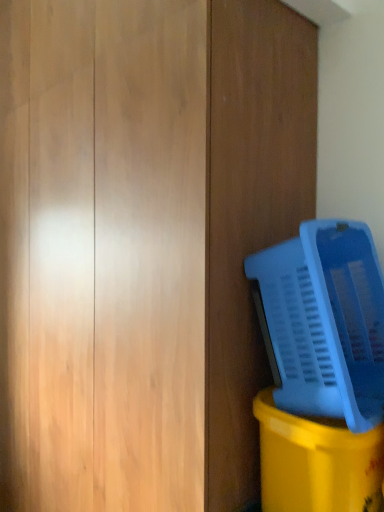
Question: From a real-world perspective, is blue plastic basket at right positioned under matte plastic basket at lower right based on gravity?

Choices:
 (A) yes
 (B) no

Answer: (B)

Question: Can you confirm if blue plastic basket at right is positioned to the right of matte plastic basket at lower right?

Choices:
 (A) yes
 (B) no

Answer: (B)

Question: From the image's perspective, is blue plastic basket at right over matte plastic basket at lower right?

Choices:
 (A) no
 (B) yes

Answer: (B)

Question: Does blue plastic basket at right have a lesser height compared to matte plastic basket at lower right?

Choices:
 (A) yes
 (B) no

Answer: (B)

Question: From the image's perspective, is blue plastic basket at right beneath matte plastic basket at lower right?

Choices:
 (A) no
 (B) yes

Answer: (A)

Question: Is blue plastic basket at right behind matte plastic basket at lower right?

Choices:
 (A) yes
 (B) no

Answer: (B)

Question: Does matte plastic basket at lower right have a lesser height compared to blue plastic basket at right?

Choices:
 (A) yes
 (B) no

Answer: (A)

Question: Are matte plastic basket at lower right and blue plastic basket at right beside each other?

Choices:
 (A) no
 (B) yes

Answer: (A)

Question: Is matte plastic basket at lower right looking in the opposite direction of blue plastic basket at right?

Choices:
 (A) yes
 (B) no

Answer: (B)

Question: From a real-world perspective, is matte plastic basket at lower right located higher than blue plastic basket at right?

Choices:
 (A) no
 (B) yes

Answer: (A)

Question: Does matte plastic basket at lower right lie behind blue plastic basket at right?

Choices:
 (A) yes
 (B) no

Answer: (A)

Question: Could you tell me if matte plastic basket at lower right is facing blue plastic basket at right?

Choices:
 (A) no
 (B) yes

Answer: (A)

Question: From the image's perspective, is matte plastic basket at lower right above or below blue plastic basket at right?

Choices:
 (A) below
 (B) above

Answer: (A)